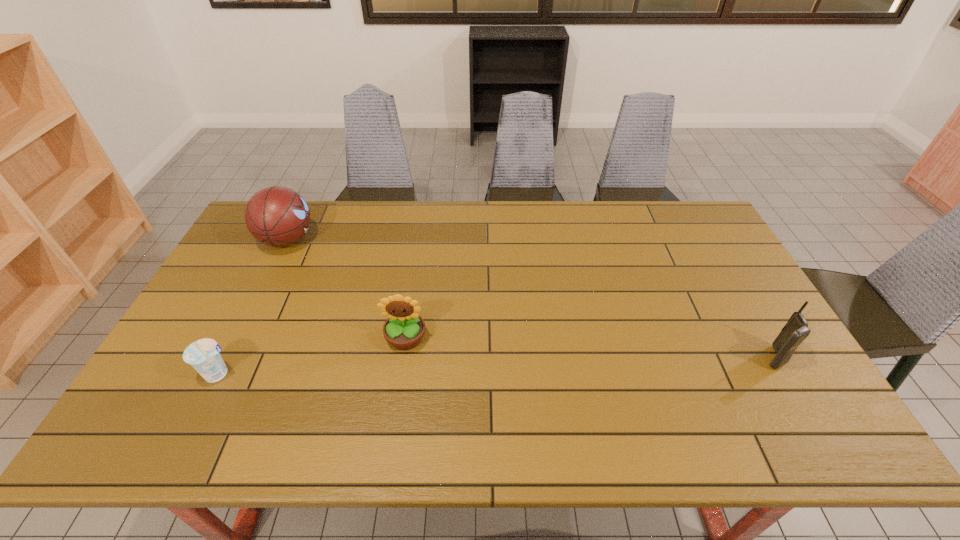
The width and height of the screenshot is (960, 540). I want to click on the farthest object, so click(276, 216).

The width and height of the screenshot is (960, 540). I want to click on cellular telephone, so [796, 330].

Find the location of a particular element. The image size is (960, 540). sunflower is located at coordinates (404, 329).

I want to click on the shortest object, so click(203, 355).

The width and height of the screenshot is (960, 540). Find the location of `vacant space situated on the right of the basketball`. vacant space situated on the right of the basketball is located at coordinates (374, 240).

Identify the location of vacant region located 0.120m on the keyboard of the cellular telephone. (716, 357).

In order to click on free space located on the keyboard of the cellular telephone in this screenshot , I will do `click(666, 357)`.

Find the location of a particular element. The height and width of the screenshot is (540, 960). vacant space situated on the keyboard of the cellular telephone is located at coordinates (651, 357).

The width and height of the screenshot is (960, 540). Identify the location of vacant space located 0.120m on the face of the sunflower. (396, 395).

Identify the location of vacant space located 0.330m on the back of the shortest object. Image resolution: width=960 pixels, height=540 pixels. (269, 274).